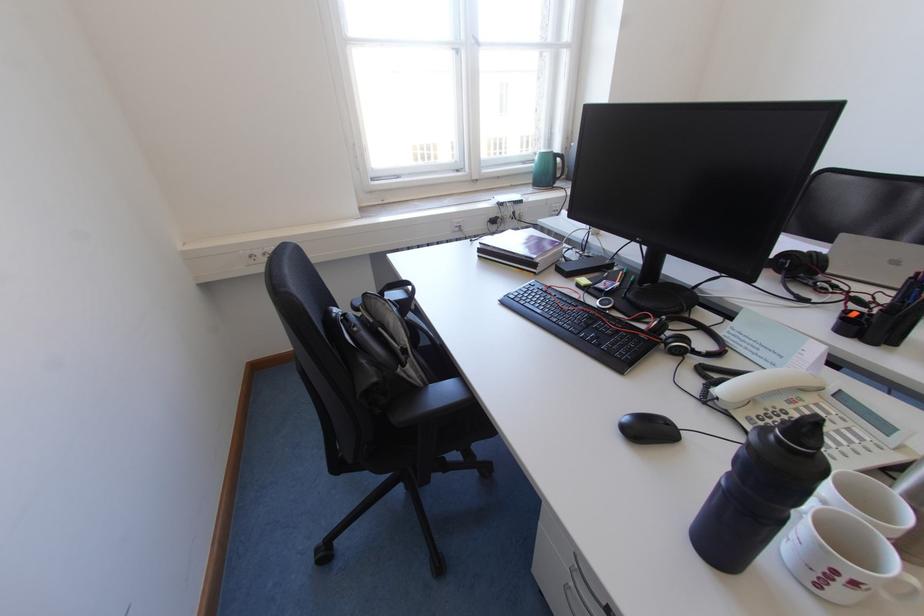
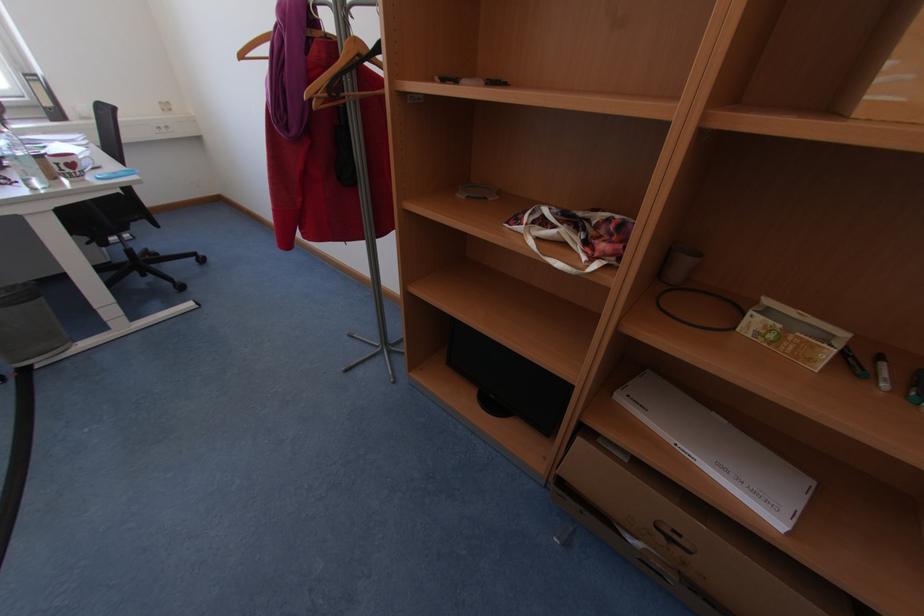
Which direction would the cameraman need to move to produce the second image?

The movement direction of the cameraman is right, backward.